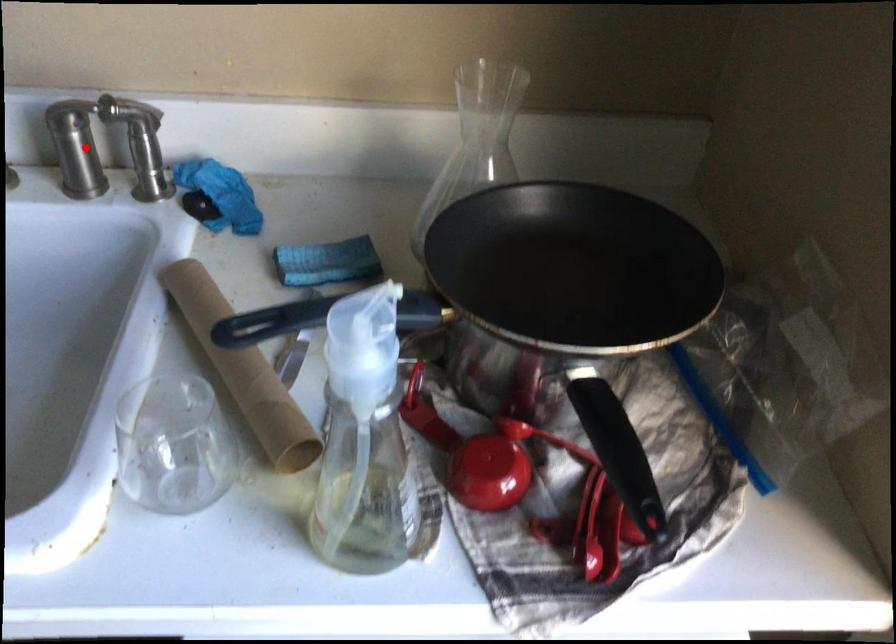
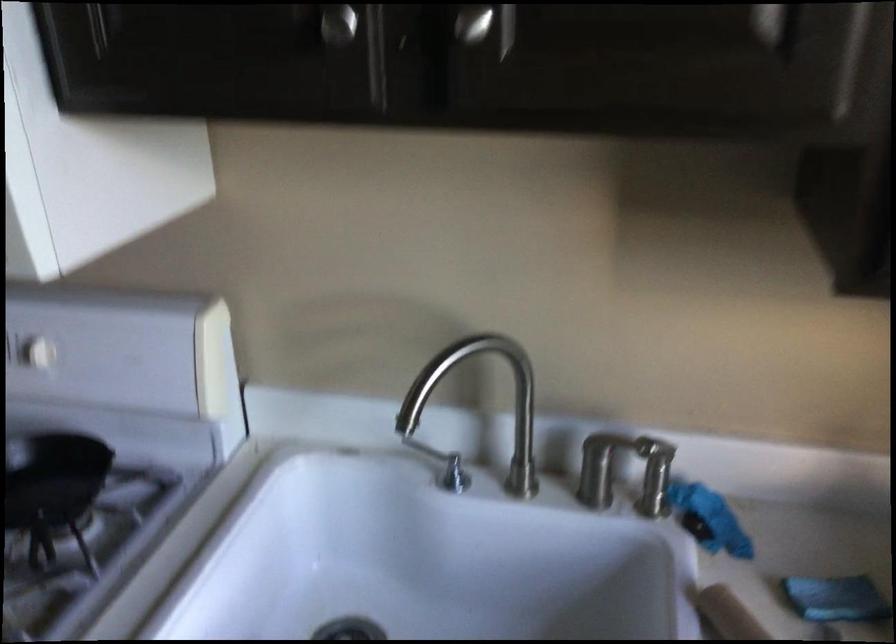
Question: I am providing you with two images of the same scene from different viewpoints. Image1 has a red point marked. In image2, the corresponding 3D location appears at what relative position? Reply with the corresponding letter.

Choices:
 (A) Closer
 (B) Farther

Answer: (B)